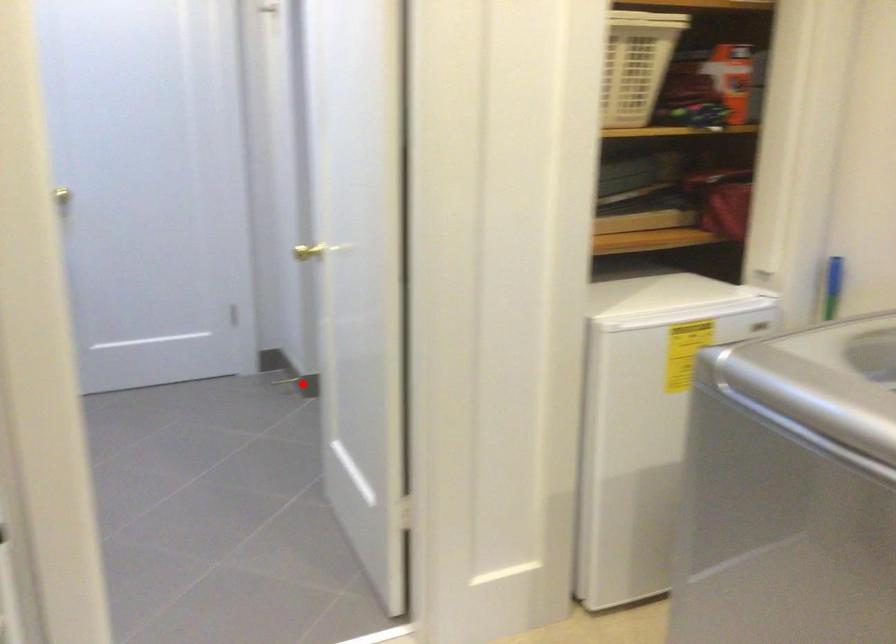
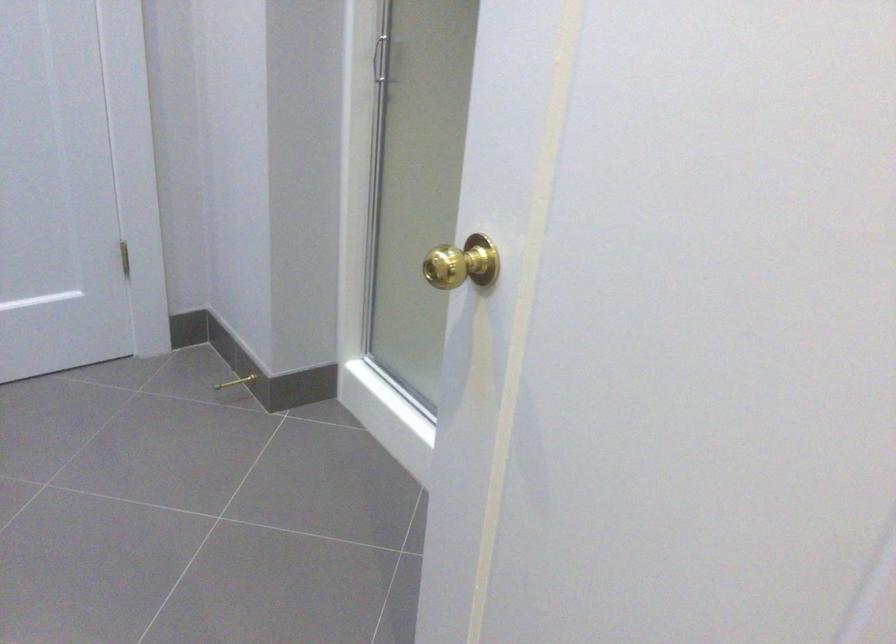
The point at the highlighted location is marked in the first image. Where is the corresponding point in the second image?

(235, 382)